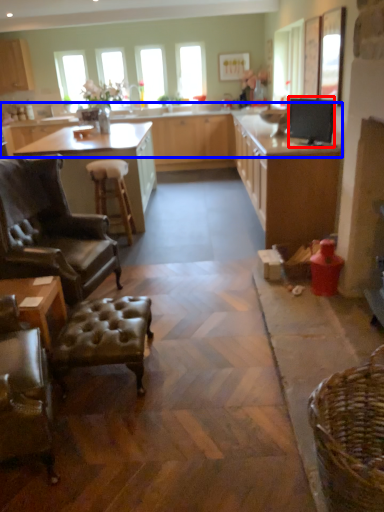
Question: Which object is further to the camera taking this photo, appliance (highlighted by a red box) or countertop (highlighted by a blue box)?

Choices:
 (A) appliance
 (B) countertop

Answer: (B)